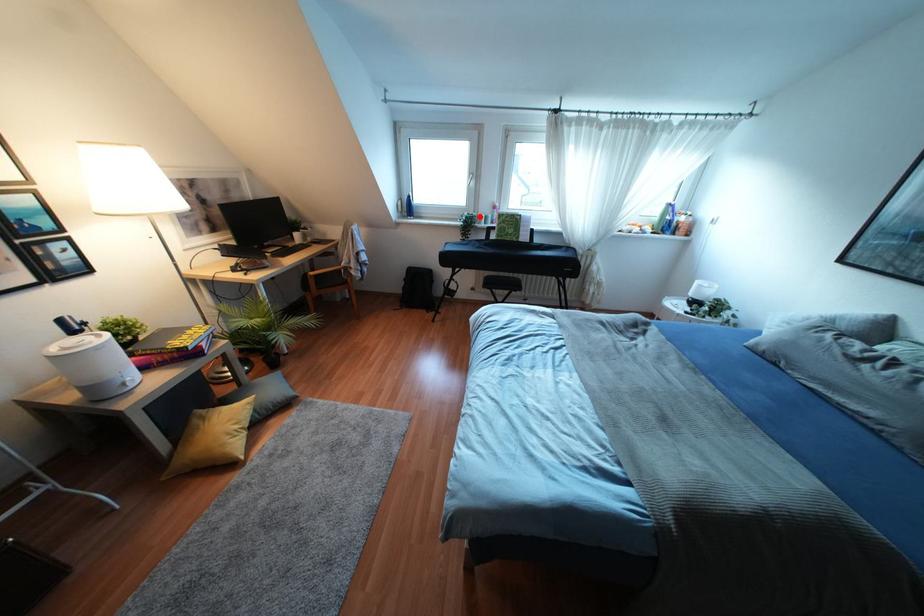
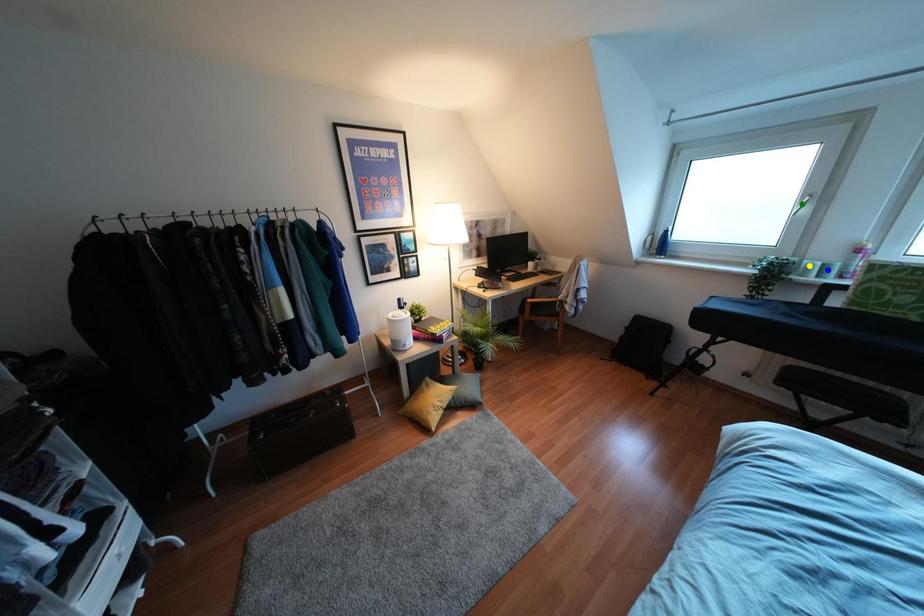
Question: I am providing you with two images of the same scene from different viewpoints. A red point is marked on the first image. You are given multiple points on the second image. Can you choose the point in image 2 that corresponds to the point in image 1?

Choices:
 (A) green point
 (B) yellow point
 (C) blue point

Answer: (B)